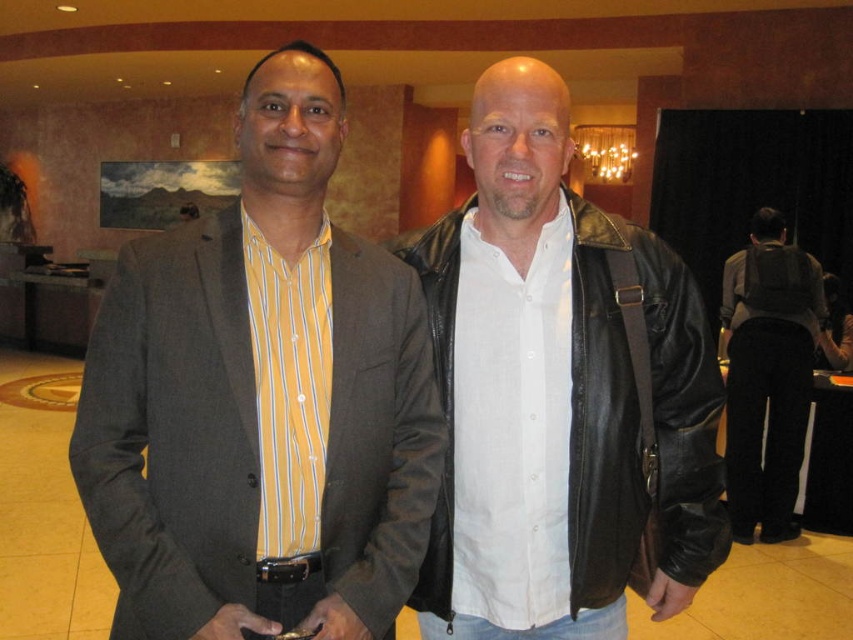
You are a photographer setting up a shoot in this lobby. You want to place a small prop between the matte gray blazer at center and the black leather jacket at right so that it is equidistant from both. Is this possible given their positions?

The matte gray blazer at center is closer to the viewer than the black leather jacket at right, so placing a prop equidistant between them would require positioning it closer to the black leather jacket at right to account for the difference in depth.

You are a photographer preparing to take a group photo of the two people in the scene. The matte gray blazer at center and the black leather jacket at center are both in the frame. Which clothing item will appear bigger in the photo?

The matte gray blazer at center will appear bigger in the photo because it has a larger size compared to the black leather jacket at center.